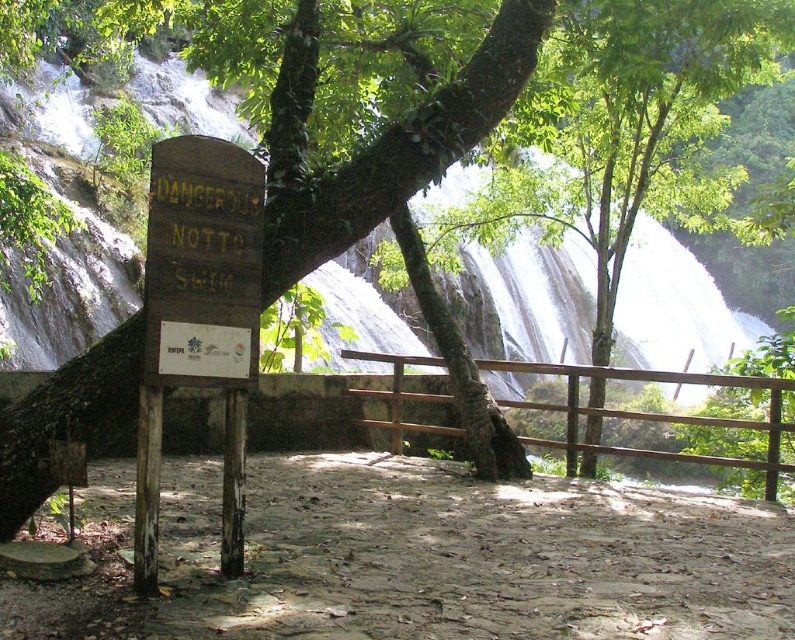
In the scene shown: Which of these two, white frothy water at center or wooden sign at center, stands taller?

white frothy water at center is taller.

Is point (700, 316) closer to viewer compared to point (156, 168)?

No.

At what (x,y) coordinates should I click in order to perform the action: click on white frothy water at center. Please return your answer as a coordinate pair (x, y). This screenshot has width=795, height=640. Looking at the image, I should click on (673, 307).